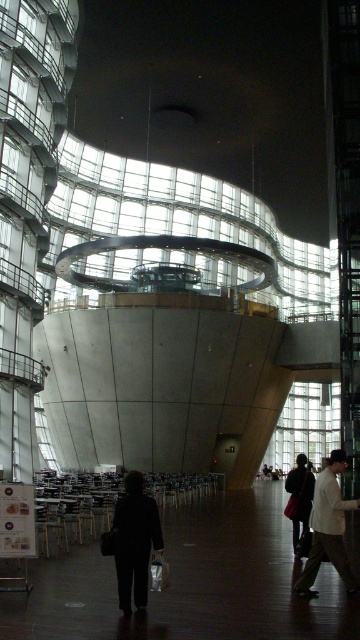
You are an event planner arranging a photoshoot in the modern architectural space. You need to position a model wearing the dark matte coat at center and another wearing the matte black jacket at center. Since both are at the center, how can you ensure they are both visible in the photos?

The dark matte coat at center is in front of the matte black jacket at center, so positioning the model in the dark matte coat slightly forward will keep both visible without one blocking the other.

You are a visitor in this modern space and you see the light beige jacket at lower right and the matte black jacket at center. Which jacket is placed higher up in the room?

The light beige jacket at lower right is located above the matte black jacket at center, so it is placed higher up in the room.